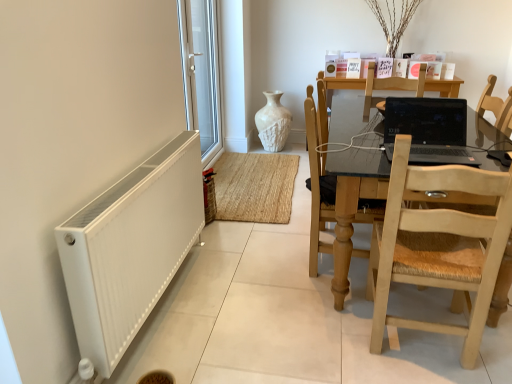
Question: Looking at their shapes, would you say light brown wooden chair at center, the first chair from the back, is wider or thinner than light wood/rattan chair at right, the first chair viewed from the front?

Choices:
 (A) wide
 (B) thin

Answer: (B)

Question: Is point (362, 211) positioned closer to the camera than point (482, 264)?

Choices:
 (A) farther
 (B) closer

Answer: (A)

Question: Estimate the real-world distances between objects in this image. Which object is farther from the light wood table at right?

Choices:
 (A) black glossy laptop at center
 (B) white textured vase at center
 (C) light brown wooden chair at center, the first chair from the back
 (D) white matte radiator at lower left
 (E) light wood/rattan chair at right, the first chair viewed from the front

Answer: (B)

Question: Estimate the real-world distances between objects in this image. Which object is farther from the white textured vase at center?

Choices:
 (A) light wood/rattan chair at right, positioned as the 2th chair in back-to-front order
 (B) light wood table at right
 (C) light brown wooden chair at center, arranged as the 2th chair when viewed from the front
 (D) white matte radiator at lower left
 (E) white plastic window at left

Answer: (A)